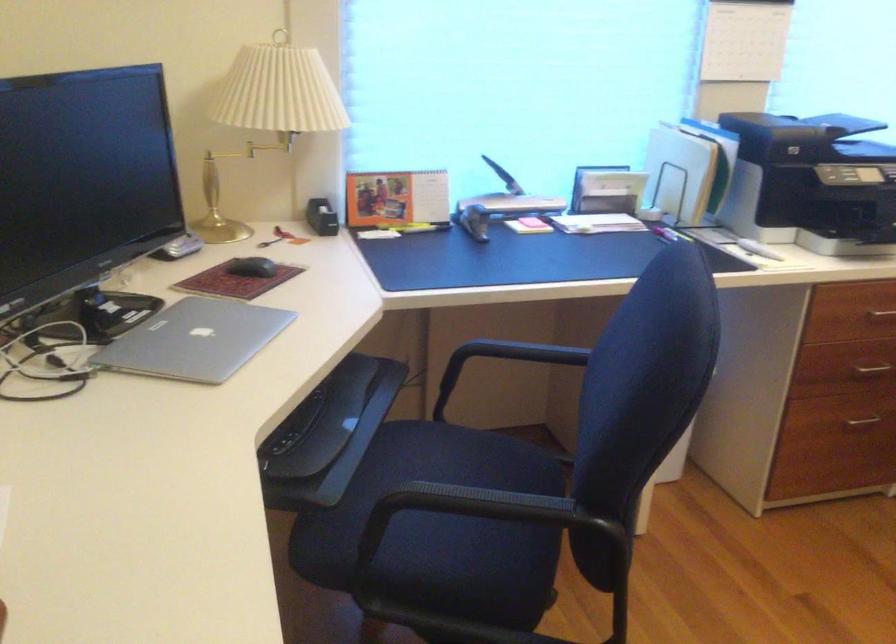
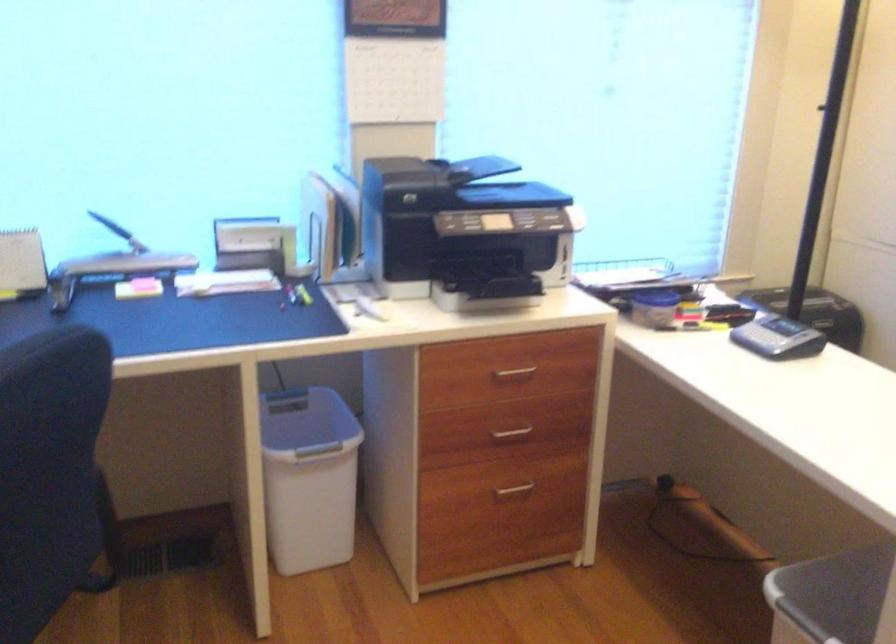
Locate, in the second image, the point that corresponds to point 506,198 in the first image.

(124, 257)